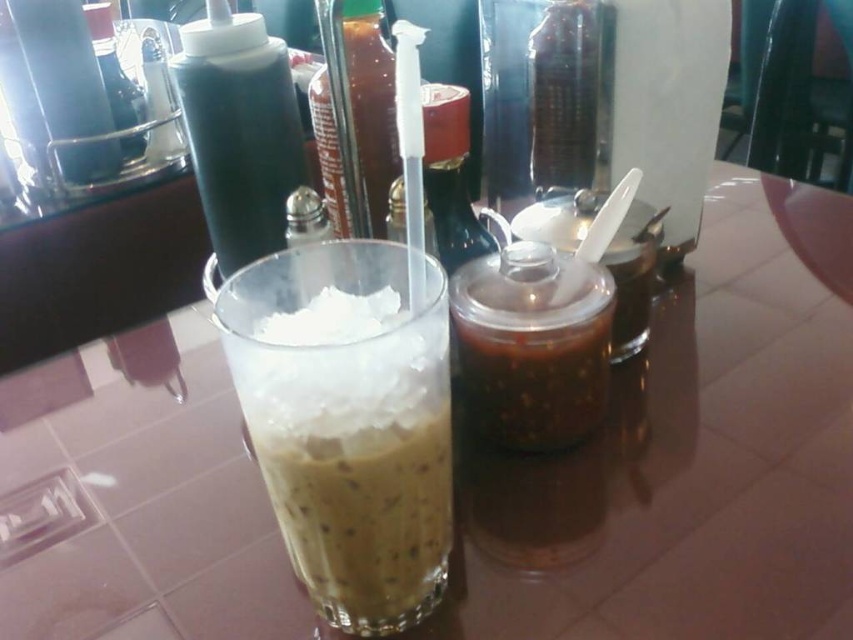
Question: Is clear plastic bottle at center below transparent plastic bottle at upper left?

Choices:
 (A) no
 (B) yes

Answer: (B)

Question: From the image, what is the correct spatial relationship of black matte bottle at upper left in relation to transparent plastic bottle at upper left?

Choices:
 (A) below
 (B) above

Answer: (A)

Question: Can you confirm if clear plastic bottle at center is positioned below transparent plastic bottle at upper center?

Choices:
 (A) no
 (B) yes

Answer: (B)

Question: Which point is closer to the camera?

Choices:
 (A) milky white glass at center
 (B) black matte bottle at upper left
 (C) transparent plastic bottle at upper left

Answer: (A)

Question: Estimate the real-world distances between objects in this image. Which object is closer to the transparent plastic bottle at upper left?

Choices:
 (A) transparent plastic bottle at upper center
 (B) milky white glass at center
 (C) black matte bottle at upper left

Answer: (C)

Question: Among these objects, which one is farthest from the camera?

Choices:
 (A) transparent plastic bottle at upper center
 (B) clear plastic bottle at center

Answer: (A)